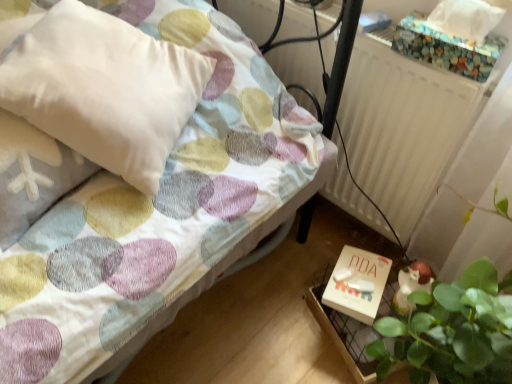
Question: From a real-world perspective, is white matte radiator at upper right positioned under white matte box at lower right based on gravity?

Choices:
 (A) yes
 (B) no

Answer: (B)

Question: From a real-world perspective, does white matte radiator at upper right stand above white matte box at lower right?

Choices:
 (A) yes
 (B) no

Answer: (A)

Question: From the image's perspective, is white matte radiator at upper right below white matte box at lower right?

Choices:
 (A) no
 (B) yes

Answer: (A)

Question: Is white matte radiator at upper right bigger than white matte box at lower right?

Choices:
 (A) no
 (B) yes

Answer: (B)

Question: Does white matte radiator at upper right come behind white matte box at lower right?

Choices:
 (A) no
 (B) yes

Answer: (A)

Question: Considering the relative positions of pastel polka dot fabric bed at center and white matte box at lower right in the image provided, is pastel polka dot fabric bed at center to the left or to the right of white matte box at lower right?

Choices:
 (A) right
 (B) left

Answer: (B)

Question: Choose the correct answer: Is pastel polka dot fabric bed at center inside white matte box at lower right or outside it?

Choices:
 (A) outside
 (B) inside

Answer: (A)

Question: Looking at their shapes, would you say pastel polka dot fabric bed at center is wider or thinner than white matte box at lower right?

Choices:
 (A) thin
 (B) wide

Answer: (B)

Question: From the image's perspective, is pastel polka dot fabric bed at center above or below white matte box at lower right?

Choices:
 (A) above
 (B) below

Answer: (A)

Question: From a real-world perspective, relative to white matte radiator at upper right, is white soft pillow at upper left vertically above or below?

Choices:
 (A) below
 (B) above

Answer: (B)

Question: From the image's perspective, is white soft pillow at upper left located above or below white matte radiator at upper right?

Choices:
 (A) below
 (B) above

Answer: (A)

Question: In the image, is white soft pillow at upper left positioned in front of or behind white matte radiator at upper right?

Choices:
 (A) front
 (B) behind

Answer: (A)

Question: Is white soft pillow at upper left wider or thinner than white matte radiator at upper right?

Choices:
 (A) thin
 (B) wide

Answer: (B)

Question: Visually, is white matte box at lower right positioned to the left or to the right of pastel polka dot fabric bed at center?

Choices:
 (A) right
 (B) left

Answer: (A)

Question: In terms of size, does white matte box at lower right appear bigger or smaller than pastel polka dot fabric bed at center?

Choices:
 (A) big
 (B) small

Answer: (B)